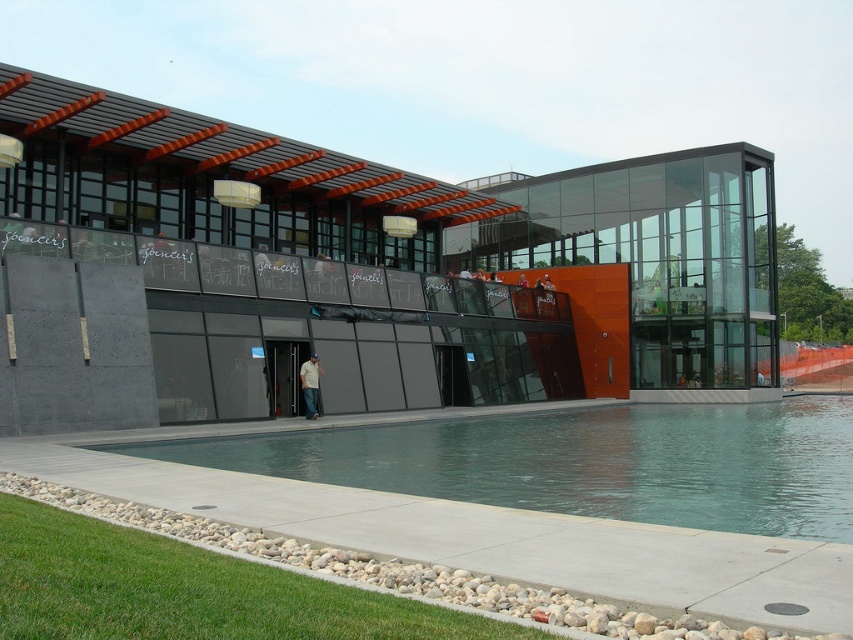
Between green concrete pool at lower center and denim jeans at center, which one appears on the left side from the viewer's perspective?

denim jeans at center is more to the left.

Between green concrete pool at lower center and denim jeans at center, which one is positioned higher?

denim jeans at center is above.

Identify the location of green concrete pool at lower center. (582, 461).